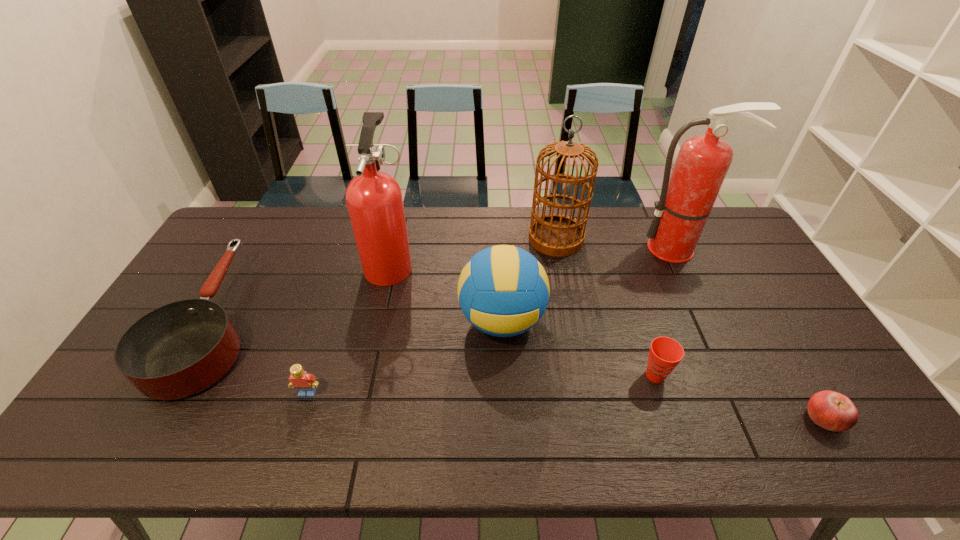
Locate an element on the screen. the right fire extinguisher is located at coordinates (686, 200).

This screenshot has width=960, height=540. In order to click on the left fire extinguisher in this screenshot , I will do `click(374, 200)`.

At what (x,y) coordinates should I click in order to perform the action: click on birdcage. Please return your answer as a coordinate pair (x, y). Looking at the image, I should click on (558, 235).

Where is `the fifth shortest object`? The width and height of the screenshot is (960, 540). the fifth shortest object is located at coordinates (503, 291).

This screenshot has height=540, width=960. Identify the location of Lego. (304, 383).

Where is `the sixth object from left to right`? the sixth object from left to right is located at coordinates (665, 353).

Identify the location of the leftmost object. (177, 350).

Locate an element on the screen. the shortest object is located at coordinates (833, 411).

This screenshot has height=540, width=960. I want to click on free space located with the handle and hose on the right fire extinguisher, so click(x=708, y=310).

The width and height of the screenshot is (960, 540). I want to click on vacant space located on the front of the third object from left to right, so click(x=360, y=402).